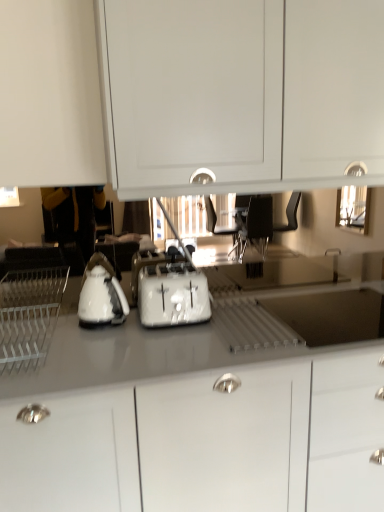
The image size is (384, 512). Identify the location of vacant space in white glossy electric kettle at center (from a real-world perspective). (97, 328).